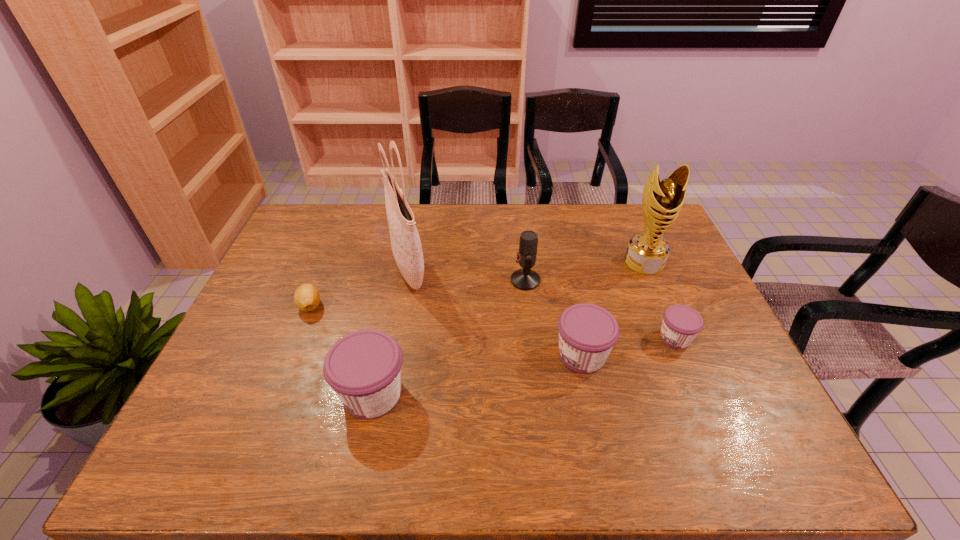
To ensure equal spacing by inserting another jam among them, please point out a vacant spot for this new jam. Please provide its 2D coordinates. Your answer should be formatted as a tuple, i.e. [(x, y)], where the tuple contains the x and y coordinates of a point satisfying the conditions above.

[(481, 374)]